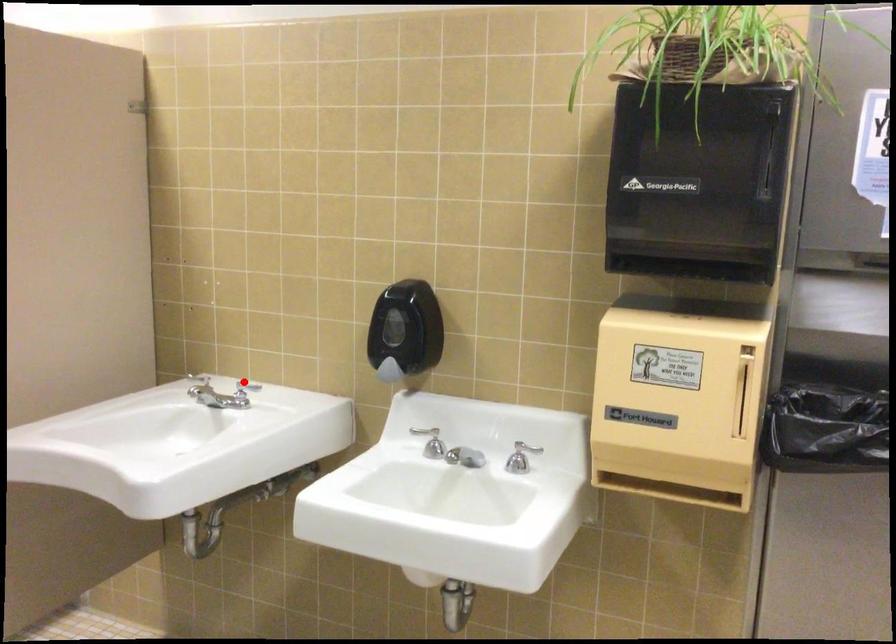
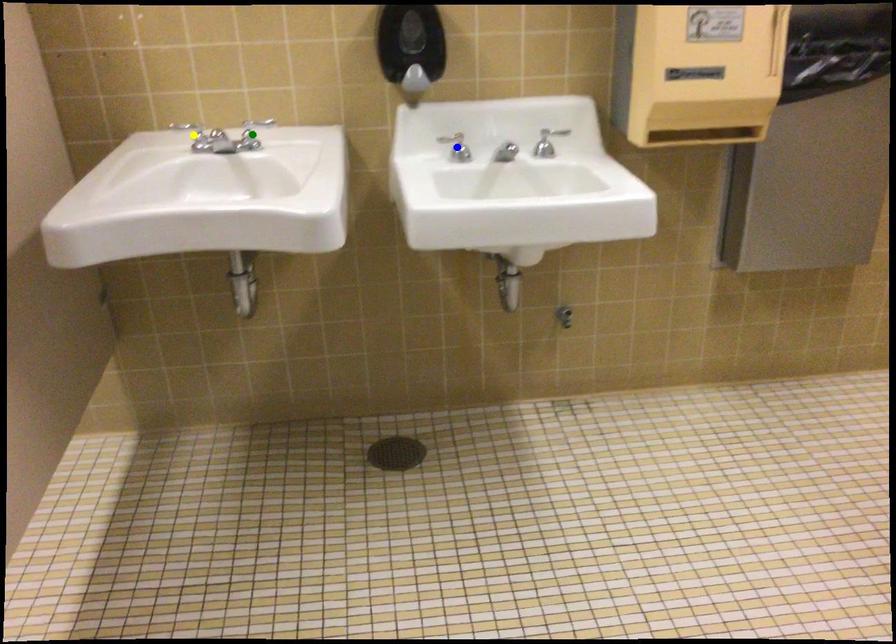
Question: I am providing you with two images of the same scene from different viewpoints. A red point is marked on the first image. You are given multiple points on the second image. Which point in image 2 is actually the same real-world point as the red point in image 1?

Choices:
 (A) green point
 (B) yellow point
 (C) blue point

Answer: (B)